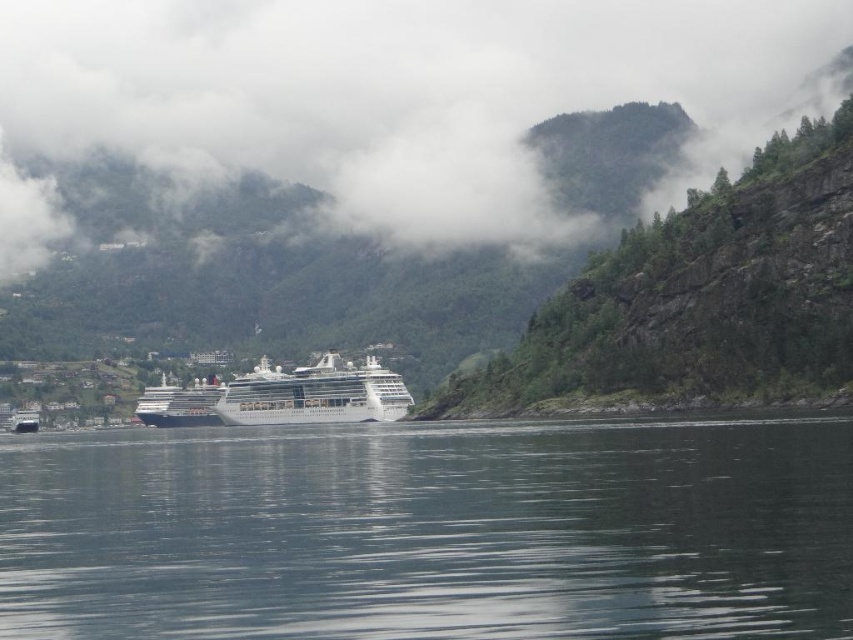
Question: Does clear water at center come behind white fluffy cloud at upper center?

Choices:
 (A) no
 (B) yes

Answer: (A)

Question: Which object appears closest to the camera in this image?

Choices:
 (A) clear water at center
 (B) green rocky hillside at upper center

Answer: (A)

Question: Which of the following is the closest to the observer?

Choices:
 (A) clear water at center
 (B) white glossy cruise ship at center

Answer: (A)

Question: Which object is the closest to the green rocky hillside at upper center?

Choices:
 (A) white fluffy cloud at upper center
 (B) clear water at center

Answer: (B)

Question: Can you confirm if clear water at center is positioned to the left of white glossy cruise ship at center?

Choices:
 (A) no
 (B) yes

Answer: (A)

Question: Is green rocky hillside at upper center further to the viewer compared to white glossy cruise ship at center?

Choices:
 (A) no
 (B) yes

Answer: (A)